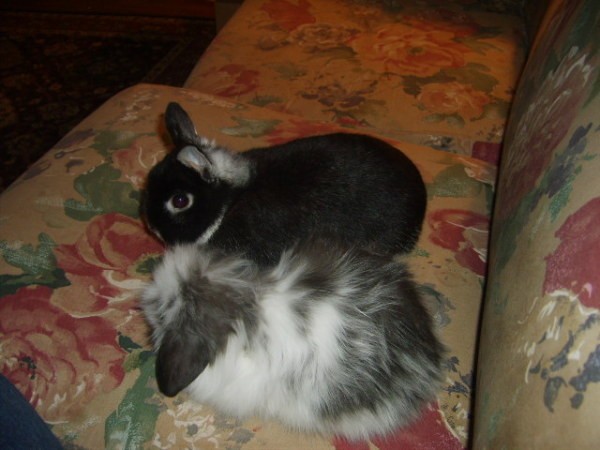
The width and height of the screenshot is (600, 450). I want to click on titled floor, so click(201, 10).